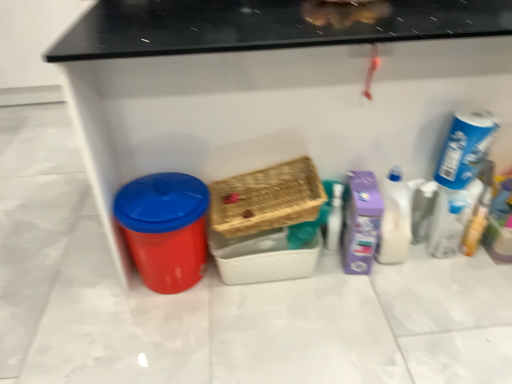
The width and height of the screenshot is (512, 384). In order to click on woven wood basket at center, the first basket in the bottom-to-top sequence in this screenshot , I will do `click(262, 257)`.

This screenshot has height=384, width=512. I want to click on blue cardboard box at upper right, the 1th cleaning product viewed from the right, so click(x=466, y=147).

You are a GUI agent. You are given a task and a screenshot of the screen. Output one action in this format:
    pyautogui.click(x=<x>, y=<y>)
    Task: Click on the purple cardboard box at right, acting as the third cleaning product starting from the right
    
    Given the screenshot: What is the action you would take?
    pyautogui.click(x=360, y=222)

Where is `matte plastic bin at left`? The image size is (512, 384). matte plastic bin at left is located at coordinates (277, 86).

This screenshot has width=512, height=384. In order to click on woven wood basket at center, arranged as the second basket when viewed from the top in this screenshot , I will do `click(262, 257)`.

Is matte plastic bin at left shorter than blue cardboard box at upper right, the 1th cleaning product viewed from the right?

No.

Is matte plastic bin at left to the left or to the right of blue cardboard box at upper right, the 1th cleaning product viewed from the right, in the image?

In the image, matte plastic bin at left appears on the left side of blue cardboard box at upper right, the 1th cleaning product viewed from the right.

Does matte plastic bin at left have a larger size compared to blue cardboard box at upper right, which is the 3th cleaning product in left-to-right order?

Yes, matte plastic bin at left is bigger than blue cardboard box at upper right, which is the 3th cleaning product in left-to-right order.

In the scene shown: Is matte plastic bin at left beside blue cardboard box at upper right, the 1th cleaning product viewed from the right?

No, matte plastic bin at left is not making contact with blue cardboard box at upper right, the 1th cleaning product viewed from the right.

Is point (372, 184) more distant than point (407, 232)?

No, (372, 184) is closer to viewer.

Is purple cardboard box at right, which is the first cleaning product from left to right, completely or partially outside of white glossy bottle at right, the 2th cleaning product in the left-to-right sequence?

Yes, purple cardboard box at right, which is the first cleaning product from left to right, is located beyond the bounds of white glossy bottle at right, the 2th cleaning product in the left-to-right sequence.

Consider the image. From a real-world perspective, is purple cardboard box at right, acting as the third cleaning product starting from the right, over white glossy bottle at right, the 2th cleaning product viewed from the right?

No, from a real-world perspective, purple cardboard box at right, acting as the third cleaning product starting from the right, is not over white glossy bottle at right, the 2th cleaning product viewed from the right

Where is `cleaning product below the white glossy bottle at right, the 2th cleaning product viewed from the right (from the image's perspective)`? The width and height of the screenshot is (512, 384). cleaning product below the white glossy bottle at right, the 2th cleaning product viewed from the right (from the image's perspective) is located at coordinates (360, 222).

Is purple cardboard box at right, acting as the third cleaning product starting from the right, facing away from woven wood basket at center, the first basket in the bottom-to-top sequence?

No, purple cardboard box at right, acting as the third cleaning product starting from the right, is not facing away from woven wood basket at center, the first basket in the bottom-to-top sequence.

Which object is closer to the camera, purple cardboard box at right, acting as the third cleaning product starting from the right, or woven wood basket at center, the first basket in the bottom-to-top sequence?

Positioned in front is purple cardboard box at right, acting as the third cleaning product starting from the right.

Which point is more forward, (x=346, y=208) or (x=298, y=270)?

The point (x=298, y=270) is in front.

Is purple cardboard box at right, which is the first cleaning product from left to right, located outside woven wood basket at center, arranged as the second basket when viewed from the top?

Absolutely, purple cardboard box at right, which is the first cleaning product from left to right, is external to woven wood basket at center, arranged as the second basket when viewed from the top.

Is point (353, 205) closer or farther from the camera than point (467, 127)?

Point (353, 205) is positioned farther from the camera compared to point (467, 127).

Does purple cardboard box at right, which is the first cleaning product from left to right, have a lesser height compared to blue cardboard box at upper right, which is the 3th cleaning product in left-to-right order?

No, purple cardboard box at right, which is the first cleaning product from left to right, is not shorter than blue cardboard box at upper right, which is the 3th cleaning product in left-to-right order.

Is purple cardboard box at right, which is the first cleaning product from left to right, not near blue cardboard box at upper right, which is the 3th cleaning product in left-to-right order?

No.

From the image's perspective, which is above, purple cardboard box at right, acting as the third cleaning product starting from the right, or blue cardboard box at upper right, which is the 3th cleaning product in left-to-right order?

blue cardboard box at upper right, which is the 3th cleaning product in left-to-right order, appears higher in the image.

Consider the image. From the image's perspective, which one is positioned higher, white glossy bottle at right, the 2th cleaning product viewed from the right, or purple cardboard box at right, which is the first cleaning product from left to right?

white glossy bottle at right, the 2th cleaning product viewed from the right, appears higher in the image.

Does white glossy bottle at right, the 2th cleaning product in the left-to-right sequence, touch purple cardboard box at right, which is the first cleaning product from left to right?

Yes, white glossy bottle at right, the 2th cleaning product in the left-to-right sequence, is next to purple cardboard box at right, which is the first cleaning product from left to right.

From a real-world perspective, which is physically below, white glossy bottle at right, the 2th cleaning product in the left-to-right sequence, or purple cardboard box at right, acting as the third cleaning product starting from the right?

purple cardboard box at right, acting as the third cleaning product starting from the right.

Image resolution: width=512 pixels, height=384 pixels. Identify the location of cleaning product on the left of white glossy bottle at right, the 2th cleaning product viewed from the right. (360, 222).

Is transparent plastic bottle at right wider than woven wood basket at center, arranged as the second basket when viewed from the top?

In fact, transparent plastic bottle at right might be narrower than woven wood basket at center, arranged as the second basket when viewed from the top.

Can you confirm if transparent plastic bottle at right is bigger than woven wood basket at center, arranged as the second basket when viewed from the top?

Incorrect, transparent plastic bottle at right is not larger than woven wood basket at center, arranged as the second basket when viewed from the top.

Is point (449, 222) closer to viewer compared to point (230, 246)?

No, it is behind (230, 246).

Locate an element on the screen. toiletry above the woven wood basket at center, the first basket in the bottom-to-top sequence (from a real-world perspective) is located at coordinates (448, 232).

Which is less distant, (284, 258) or (349, 255)?

Point (284, 258).

What's the angular difference between woven wood basket at center, the first basket in the bottom-to-top sequence, and purple cardboard box at right, which is the first cleaning product from left to right,'s facing directions?

11.1 degrees.

Does woven wood basket at center, arranged as the second basket when viewed from the top, turn towards purple cardboard box at right, acting as the third cleaning product starting from the right?

No, woven wood basket at center, arranged as the second basket when viewed from the top, is not turned towards purple cardboard box at right, acting as the third cleaning product starting from the right.

Does woven wood basket at center, the first basket in the bottom-to-top sequence, have a larger size compared to purple cardboard box at right, acting as the third cleaning product starting from the right?

Yes.

The image size is (512, 384). I want to click on furniture that is on the left side of blue cardboard box at upper right, the 1th cleaning product viewed from the right, so click(x=277, y=86).

At what (x,y) coordinates should I click in order to perform the action: click on cleaning product below the white glossy bottle at right, the 2th cleaning product viewed from the right (from the image's perspective). Please return your answer as a coordinate pair (x, y). Looking at the image, I should click on (360, 222).

Estimate the real-world distances between objects in this image. Which object is closer to white glossy bottle at right, the 2th cleaning product in the left-to-right sequence, woven brown basket at center, the 2th basket when ordered from bottom to top, or woven wood basket at center, the first basket in the bottom-to-top sequence?

woven wood basket at center, the first basket in the bottom-to-top sequence, lies closer to white glossy bottle at right, the 2th cleaning product in the left-to-right sequence, than the other object.

Estimate the real-world distances between objects in this image. Which object is closer to blue cardboard box at upper right, which is the 3th cleaning product in left-to-right order, matte plastic bin at left or purple cardboard box at right, acting as the third cleaning product starting from the right?

purple cardboard box at right, acting as the third cleaning product starting from the right, is positioned closer to the anchor blue cardboard box at upper right, which is the 3th cleaning product in left-to-right order.

Estimate the real-world distances between objects in this image. Which object is closer to blue cardboard box at upper right, which is the 3th cleaning product in left-to-right order, woven wood basket at center, the first basket in the bottom-to-top sequence, or transparent plastic bottle at right?

The object closer to blue cardboard box at upper right, which is the 3th cleaning product in left-to-right order, is transparent plastic bottle at right.

Looking at the image, which one is located further to transparent plastic bottle at right, woven wood basket at center, arranged as the second basket when viewed from the top, or blue cardboard box at upper right, the 1th cleaning product viewed from the right?

woven wood basket at center, arranged as the second basket when viewed from the top.

Based on their spatial positions, is woven wood basket at center, the first basket in the bottom-to-top sequence, or woven brown basket at center, the 2th basket when ordered from bottom to top, further from matte plastic bin at left?

woven wood basket at center, the first basket in the bottom-to-top sequence, lies further to matte plastic bin at left than the other object.

Looking at the image, which one is located further to blue cardboard box at upper right, the 1th cleaning product viewed from the right, woven brown basket at center, the 2th basket when ordered from bottom to top, or transparent plastic bottle at right?

Based on the image, woven brown basket at center, the 2th basket when ordered from bottom to top, appears to be further to blue cardboard box at upper right, the 1th cleaning product viewed from the right.

Which object lies nearer to the anchor point matte plastic bin at left, woven brown basket at center, which appears as the first basket when viewed from the top, or woven wood basket at center, the first basket in the bottom-to-top sequence?

Based on the image, woven brown basket at center, which appears as the first basket when viewed from the top, appears to be nearer to matte plastic bin at left.

When comparing their distances from blue cardboard box at upper right, the 1th cleaning product viewed from the right, does woven wood basket at center, arranged as the second basket when viewed from the top, or matte plastic bin at left seem closer?

Based on the image, matte plastic bin at left appears to be nearer to blue cardboard box at upper right, the 1th cleaning product viewed from the right.

Find the location of a particular element. furniture located between woven brown basket at center, which appears as the first basket when viewed from the top, and white glossy bottle at right, the 2th cleaning product in the left-to-right sequence, in the left-right direction is located at coordinates (277, 86).

Locate an element on the screen. Image resolution: width=512 pixels, height=384 pixels. cleaning product between woven wood basket at center, arranged as the second basket when viewed from the top, and white glossy bottle at right, the 2th cleaning product viewed from the right is located at coordinates (360, 222).

This screenshot has width=512, height=384. I want to click on cleaning product situated between woven brown basket at center, which appears as the first basket when viewed from the top, and white glossy bottle at right, the 2th cleaning product viewed from the right, from left to right, so click(x=360, y=222).

You are a GUI agent. You are given a task and a screenshot of the screen. Output one action in this format:
    pyautogui.click(x=<x>, y=<y>)
    Task: Click on the basket located between woven brown basket at center, the 2th basket when ordered from bottom to top, and purple cardboard box at right, which is the first cleaning product from left to right, in the left-right direction
    The height and width of the screenshot is (384, 512).
    Given the screenshot: What is the action you would take?
    pyautogui.click(x=262, y=257)